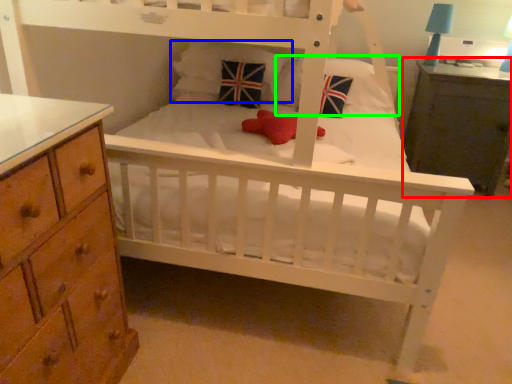
Question: Which object is positioned closest to nightstand (highlighted by a red box)? Select from pillow (highlighted by a blue box) and pillow (highlighted by a green box).

Choices:
 (A) pillow
 (B) pillow

Answer: (B)